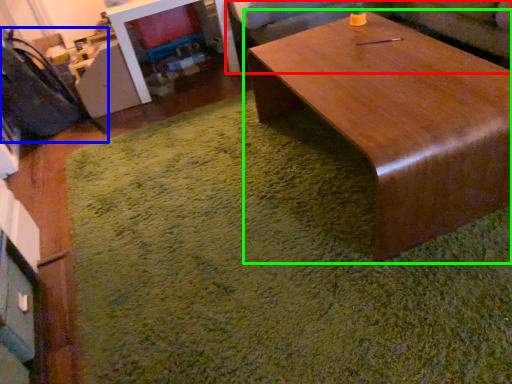
Question: Considering the real-world distances, which object is farthest from couch (highlighted by a red box)? swivel chair (highlighted by a blue box) or coffee table (highlighted by a green box)?

Choices:
 (A) swivel chair
 (B) coffee table

Answer: (A)